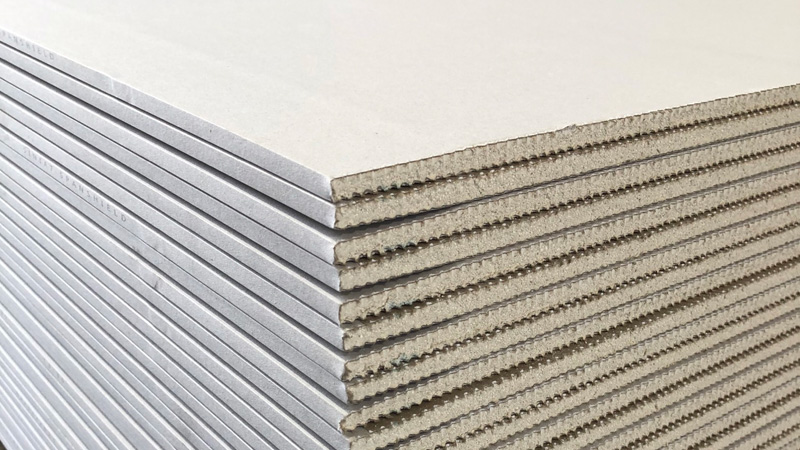
You are a GUI agent. You are given a task and a screenshot of the screen. Output one action in this format:
    pyautogui.click(x=<x>, y=<y>)
    Task: Click on the appears to be a stack of drywall, large sheets of material
    The height and width of the screenshot is (450, 800).
    Given the screenshot: What is the action you would take?
    pyautogui.click(x=330, y=344)